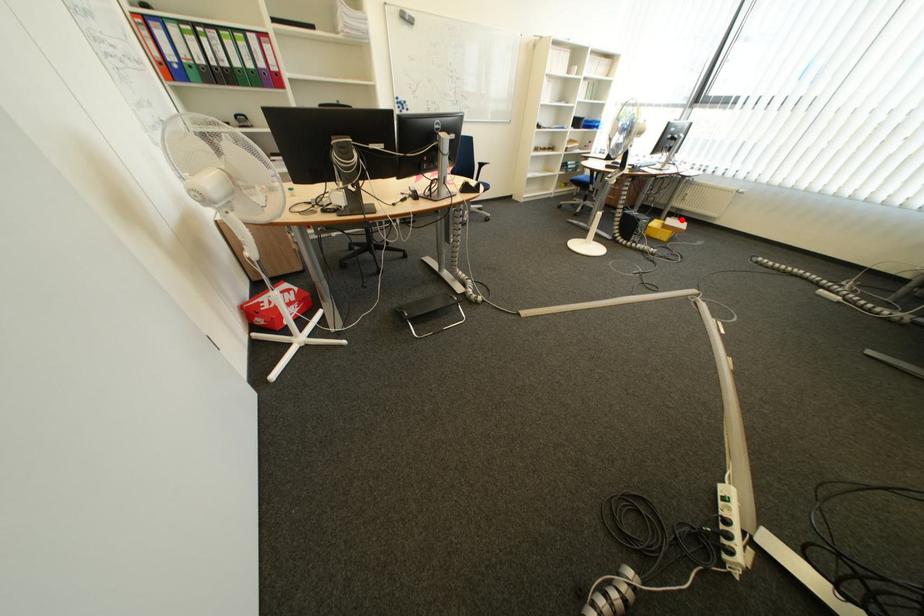
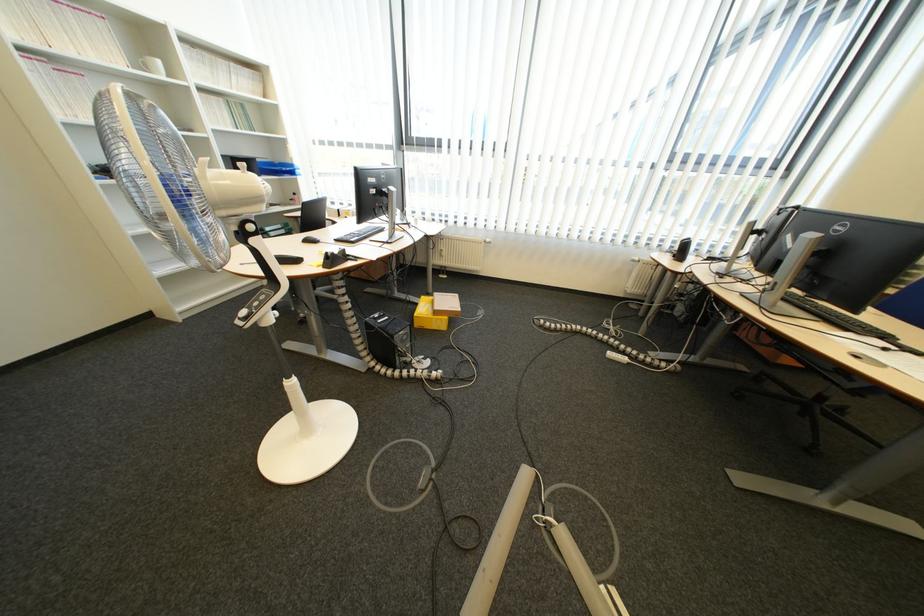
Question: I am providing you with two images of the same scene from different viewpoints. A red point is shown in image1. For the corresponding object point in image2, is it positioned nearer or farther from the camera?

Choices:
 (A) Nearer
 (B) Farther

Answer: (B)